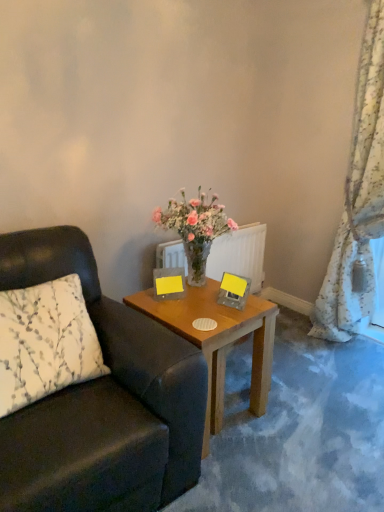
Question: Is matte yellow picture frame at upper center, the first picture frame from the left, at the back of floral fabric curtain at right?

Choices:
 (A) yes
 (B) no

Answer: (B)

Question: From the image's perspective, is floral fabric curtain at right on top of matte yellow picture frame at upper center, the first picture frame from the left?

Choices:
 (A) yes
 (B) no

Answer: (A)

Question: Is floral fabric curtain at right bigger than matte yellow picture frame at upper center, the 2th picture frame viewed from the right?

Choices:
 (A) no
 (B) yes

Answer: (B)

Question: Can matte yellow picture frame at upper center, the 2th picture frame viewed from the right, be found inside floral fabric curtain at right?

Choices:
 (A) no
 (B) yes

Answer: (A)

Question: Considering the relative sizes of floral fabric curtain at right and matte yellow picture frame at upper center, the first picture frame from the left, in the image provided, is floral fabric curtain at right taller than matte yellow picture frame at upper center, the first picture frame from the left,?

Choices:
 (A) yes
 (B) no

Answer: (A)

Question: Can you confirm if floral fabric curtain at right is wider than matte yellow picture frame at upper center, the first picture frame from the left?

Choices:
 (A) yes
 (B) no

Answer: (A)

Question: Is white printed fabric pillow at left bigger than floral fabric curtain at right?

Choices:
 (A) yes
 (B) no

Answer: (B)

Question: Can you confirm if white printed fabric pillow at left is thinner than floral fabric curtain at right?

Choices:
 (A) no
 (B) yes

Answer: (A)

Question: Is white printed fabric pillow at left looking in the opposite direction of floral fabric curtain at right?

Choices:
 (A) yes
 (B) no

Answer: (B)

Question: Can you confirm if white printed fabric pillow at left is smaller than floral fabric curtain at right?

Choices:
 (A) no
 (B) yes

Answer: (B)

Question: Considering the relative sizes of white printed fabric pillow at left and floral fabric curtain at right in the image provided, is white printed fabric pillow at left shorter than floral fabric curtain at right?

Choices:
 (A) yes
 (B) no

Answer: (A)

Question: From the image's perspective, is white printed fabric pillow at left on top of floral fabric curtain at right?

Choices:
 (A) yes
 (B) no

Answer: (B)

Question: Can you confirm if matte yellow picture frame at upper center, the 2th picture frame viewed from the right, is wider than yellow paper at center, the 1th picture frame when ordered from right to left?

Choices:
 (A) yes
 (B) no

Answer: (B)